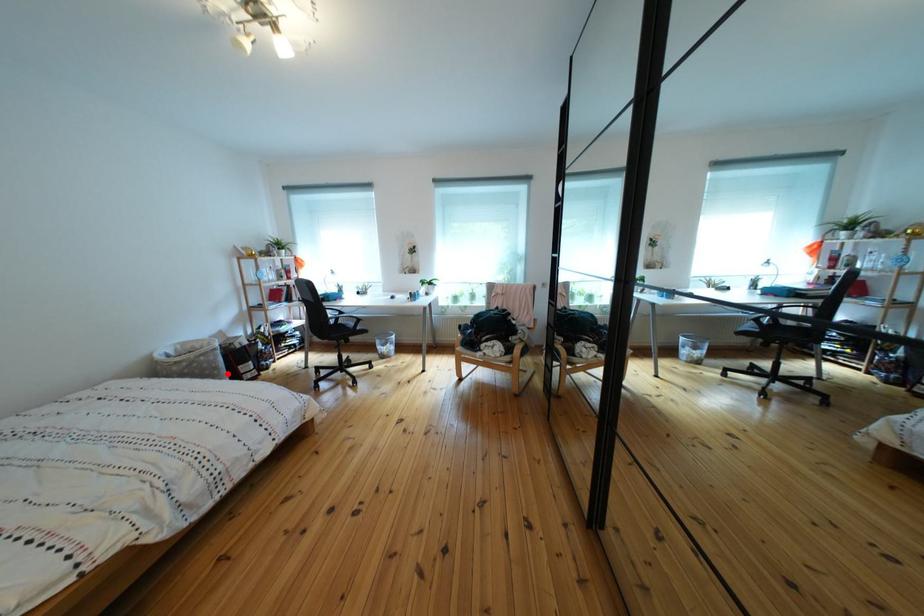
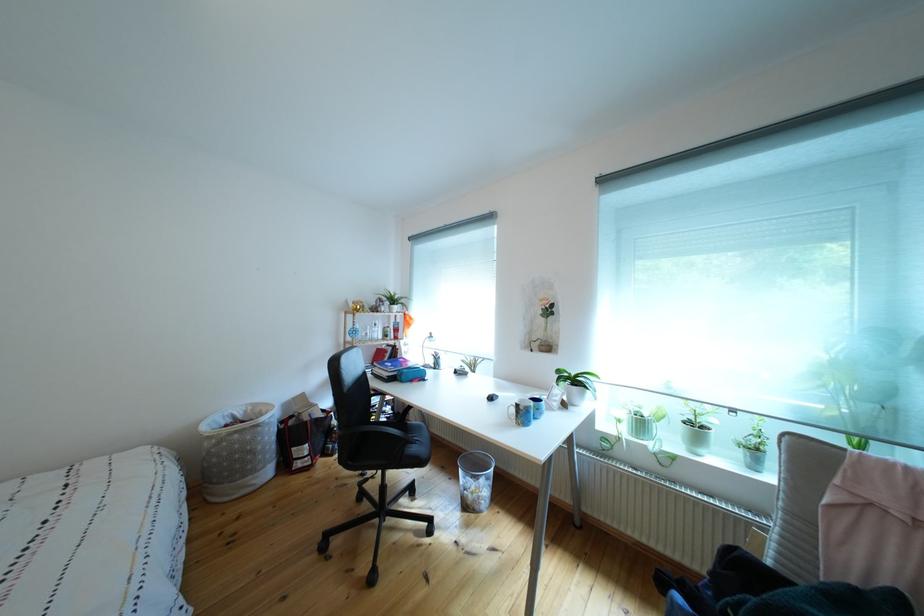
Question: I am providing you with two images of the same scene from different viewpoints. A red point is marked on the first image. Is the red point's position out of view in image 2?

Choices:
 (A) Yes
 (B) No

Answer: (B)